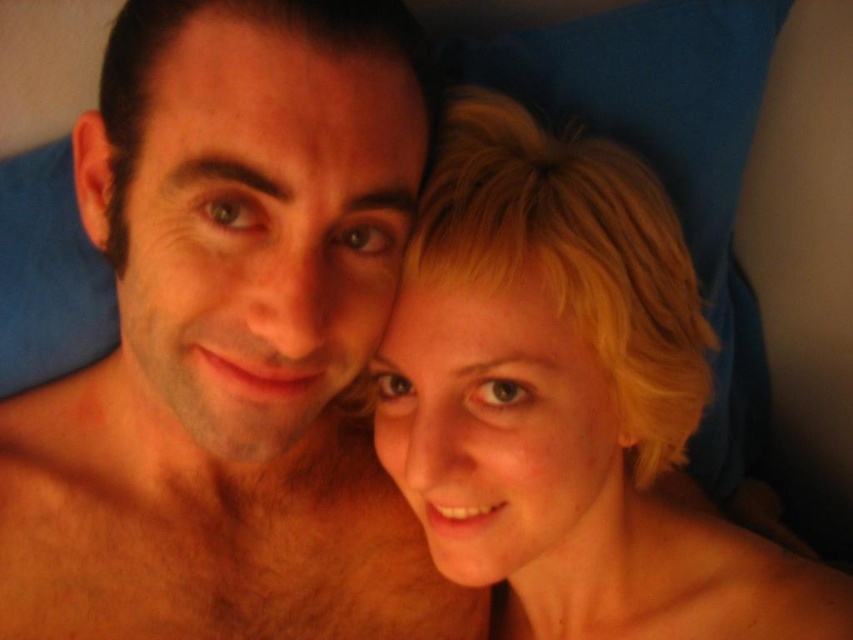
Which of these two, brown hair at left or blonde hair at center, stands shorter?

Standing shorter between the two is brown hair at left.

Does brown hair at left come in front of blonde hair at center?

Yes, it is.

Find the location of a particular element. brown hair at left is located at coordinates (231, 342).

Identify the location of brown hair at left. click(x=231, y=342).

Who is more forward, [397,148] or [195,577]?

Point [397,148] is more forward.

From the picture: Who is lower down, brown hair at left or hairy skin at lower left?

hairy skin at lower left

Does point (355, 304) come closer to viewer compared to point (384, 512)?

Yes, point (355, 304) is in front of point (384, 512).

Identify the location of brown hair at left. [x=231, y=342].

Is blonde hair at center behind hairy skin at lower left?

That is True.

Can you confirm if blonde hair at center is positioned below hairy skin at lower left?

Yes, blonde hair at center is below hairy skin at lower left.

Is point (421, 211) closer to viewer compared to point (227, 508)?

That is True.

The width and height of the screenshot is (853, 640). Identify the location of blonde hair at center. (567, 401).